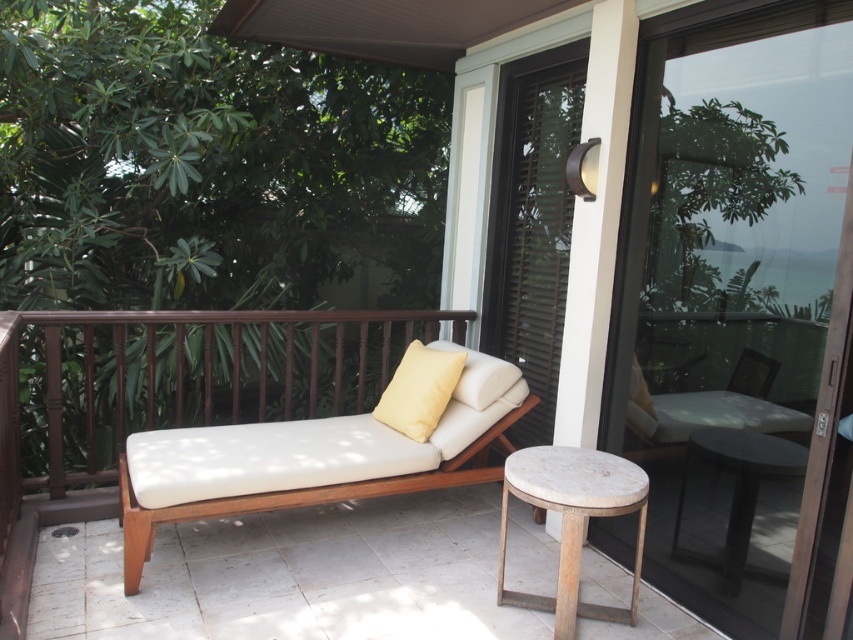
Between transparent glass screen door at right and dark wood stool at lower right, which one appears on the left side from the viewer's perspective?

Positioned to the left is dark wood stool at lower right.

Who is lower down, transparent glass screen door at right or dark wood stool at lower right?

dark wood stool at lower right

Identify the location of transparent glass screen door at right. This screenshot has width=853, height=640. (738, 308).

Which is more to the right, teak wood bench at center or dark wood stool at lower right?

dark wood stool at lower right

Between teak wood bench at center and dark wood stool at lower right, which one is positioned lower?

teak wood bench at center

I want to click on teak wood bench at center, so click(x=289, y=576).

This screenshot has height=640, width=853. In order to click on teak wood bench at center in this screenshot , I will do `click(289, 576)`.

Is point (115, 576) in front of point (428, 394)?

Yes, point (115, 576) is closer to viewer.

Can you confirm if teak wood bench at center is positioned above yellow matte pillow at center?

No.

Where is `teak wood bench at center`? This screenshot has width=853, height=640. teak wood bench at center is located at coordinates (289, 576).